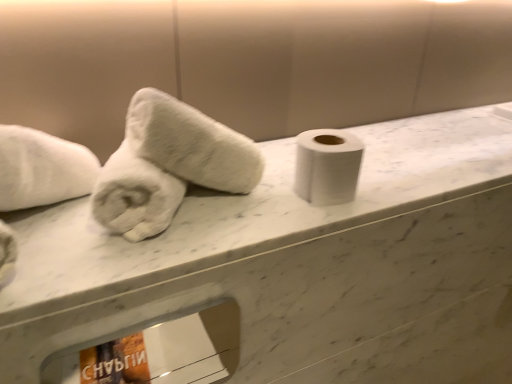
Question: Relative to white marble counter at center, is white matte toilet paper at center in front or behind?

Choices:
 (A) front
 (B) behind

Answer: (B)

Question: Is white matte toilet paper at center situated inside white marble counter at center or outside?

Choices:
 (A) outside
 (B) inside

Answer: (A)

Question: Estimate the real-world distances between objects in this image. Which object is farther from the white marble counter at center?

Choices:
 (A) white matte toilet paper at center
 (B) white fluffy towel at left, which is counted as the 2th towel, starting from the right
 (C) white fluffy towel at left, positioned as the 2th towel in left-to-right order

Answer: (B)

Question: Considering the real-world distances, which object is farthest from the white marble counter at center?

Choices:
 (A) white fluffy towel at left, positioned as the first towel in left-to-right order
 (B) white matte toilet paper at center
 (C) white fluffy towel at left, positioned as the 2th towel in left-to-right order

Answer: (A)